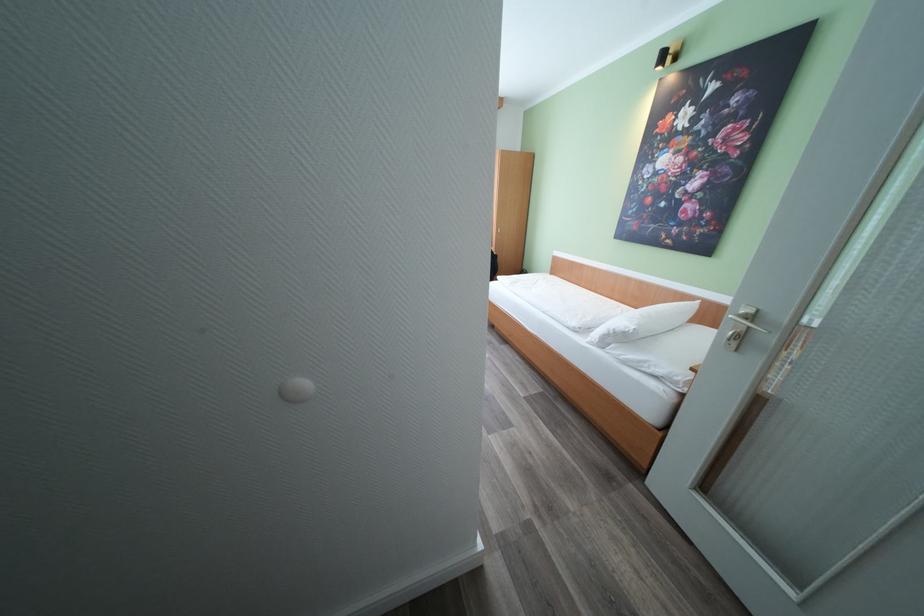
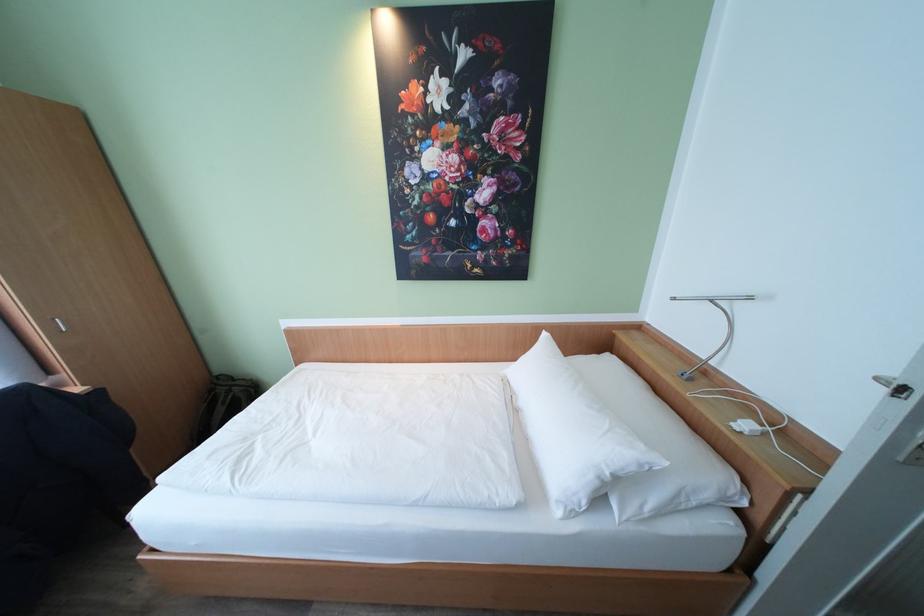
The point at (685, 377) is marked in the first image. Where is the corresponding point in the second image?

(736, 488)